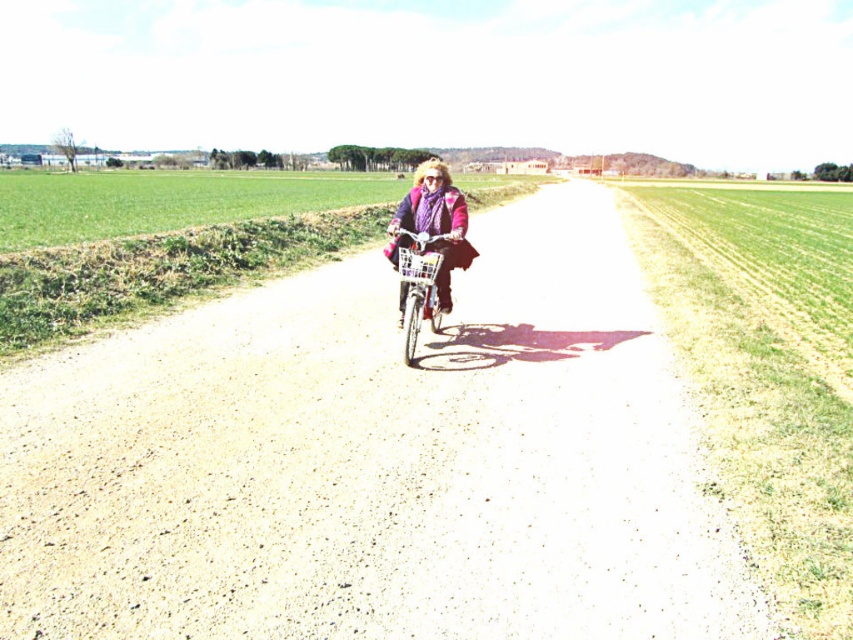
Does gravel road at center have a lesser width compared to matte purple sweater at center?

In fact, gravel road at center might be wider than matte purple sweater at center.

Does gravel road at center have a greater width compared to matte purple sweater at center?

Indeed, gravel road at center has a greater width compared to matte purple sweater at center.

What do you see at coordinates (376, 460) in the screenshot? I see `gravel road at center` at bounding box center [376, 460].

Locate an element on the screen. Image resolution: width=853 pixels, height=640 pixels. gravel road at center is located at coordinates (x=376, y=460).

Does gravel road at center have a greater width compared to metallic silver bicycle at center?

Yes.

Who is positioned more to the right, gravel road at center or metallic silver bicycle at center?

gravel road at center

Find the location of `gravel road at center`. gravel road at center is located at coordinates (376, 460).

Is matte purple sweater at center wider than metallic silver bicycle at center?

Yes.

Which of these two, matte purple sweater at center or metallic silver bicycle at center, stands shorter?

With less height is metallic silver bicycle at center.

Where is `matte purple sweater at center`? This screenshot has height=640, width=853. matte purple sweater at center is located at coordinates (434, 224).